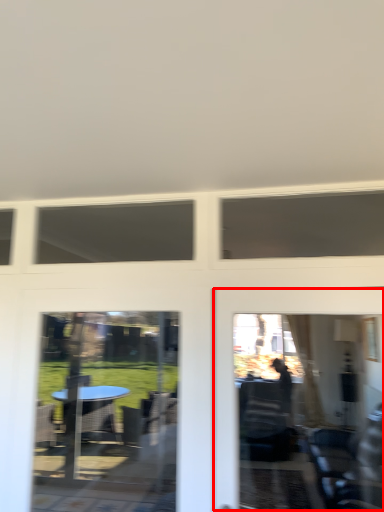
Question: From the image's perspective, where is garage door (annotated by the red box) located relative to screen door?

Choices:
 (A) above
 (B) below

Answer: (A)